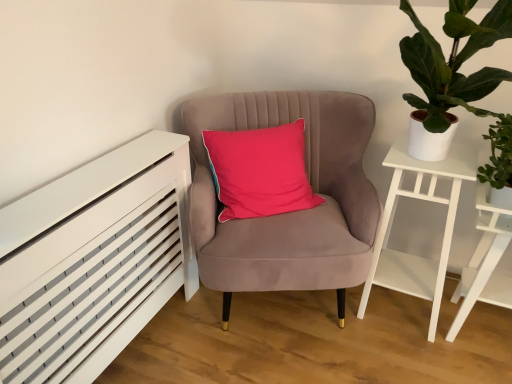
The width and height of the screenshot is (512, 384). Find the location of `free space in front of white matte side table at right`. free space in front of white matte side table at right is located at coordinates (414, 359).